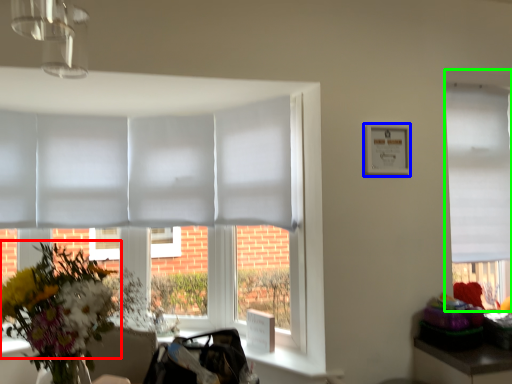
Question: Which object is the closest to the flower (highlighted by a red box)? Choose among these: picture frame (highlighted by a blue box) or window (highlighted by a green box).

Choices:
 (A) picture frame
 (B) window

Answer: (A)